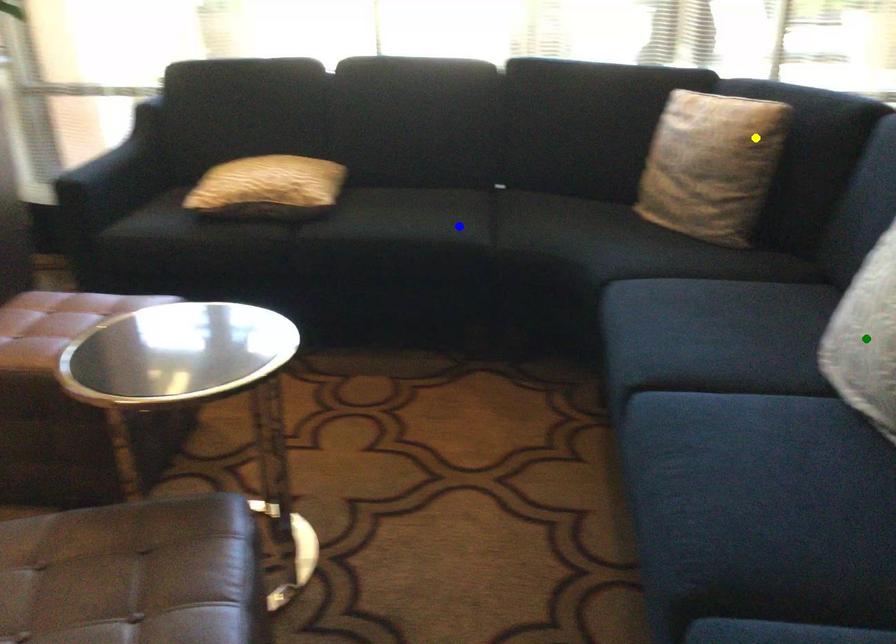
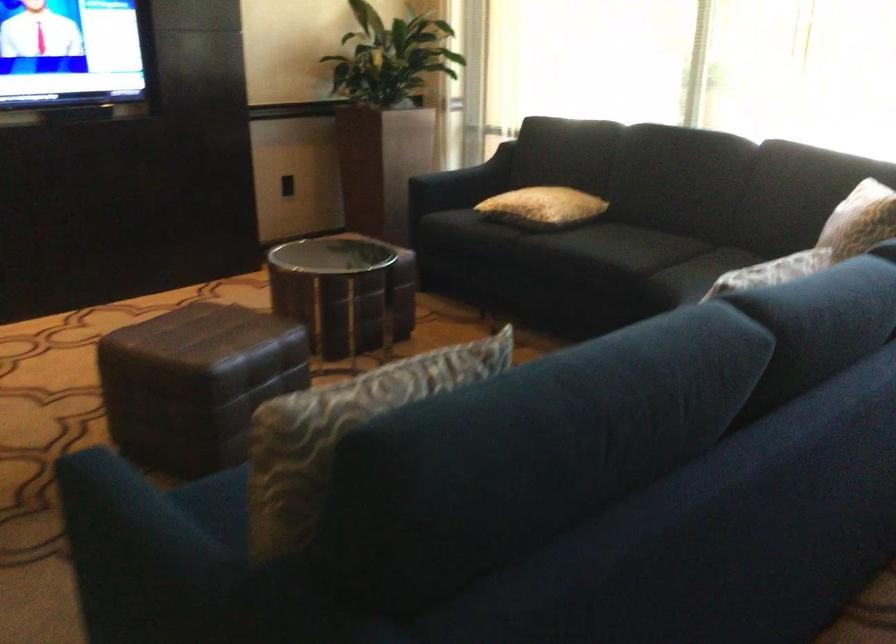
I am providing you with two images of the same scene from different viewpoints. Three points are marked in image1. Which point corresponds to a part or object that is occluded in image2?In image1, three points are marked. Which of them correspond to a part or object that is occluded in image2?Among the three points shown in image1, which one corresponds to a part or object that is no longer visible due to occlusion in image2?

green point